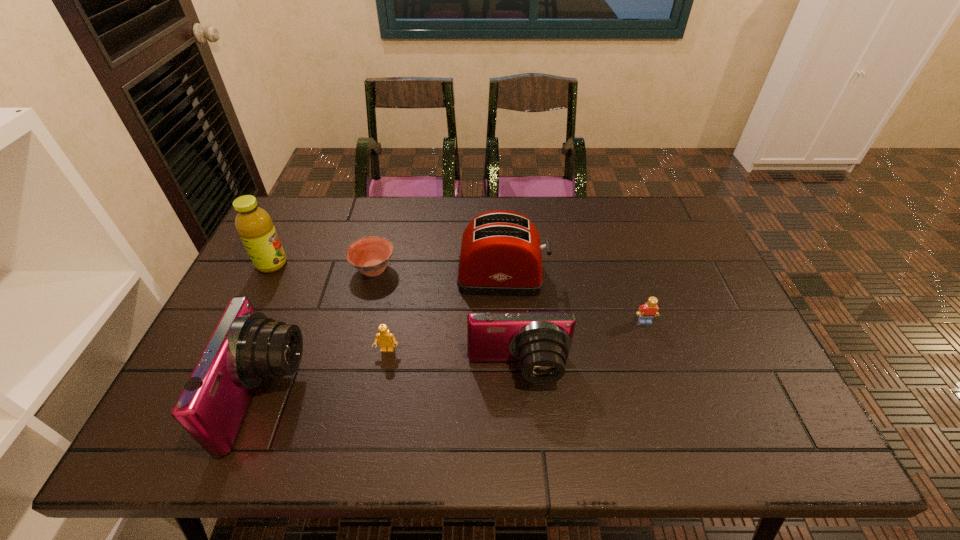
The image size is (960, 540). What are the coordinates of `the nearer Lego` in the screenshot? It's located at (385, 339).

You are a GUI agent. You are given a task and a screenshot of the screen. Output one action in this format:
    pyautogui.click(x=<x>, y=<y>)
    Task: Click on the vacant point located 0.210m on the front-facing side of the second object from left to right
    The width and height of the screenshot is (960, 540).
    Given the screenshot: What is the action you would take?
    pyautogui.click(x=389, y=396)

Locate an element on the screen. This screenshot has height=540, width=960. vacant area located on the back of the shortest object is located at coordinates (387, 214).

What are the coordinates of `vacant space situated on the front label of the fruit juice` in the screenshot? It's located at (399, 264).

Where is `free space located 0.210m on the front-facing side of the rightmost object`? free space located 0.210m on the front-facing side of the rightmost object is located at coordinates (670, 396).

Where is `vacant space located on the front of the toaster`? vacant space located on the front of the toaster is located at coordinates (506, 359).

Locate an element on the screen. This screenshot has width=960, height=540. vacant region located on the face of the nearer Lego is located at coordinates (379, 395).

This screenshot has width=960, height=540. Find the location of `camera positioned at the left edge`. camera positioned at the left edge is located at coordinates (246, 348).

Where is `fruit juice at the left edge`? This screenshot has height=540, width=960. fruit juice at the left edge is located at coordinates (254, 224).

At what (x,y) coordinates should I click in order to perform the action: click on object that is at the near left corner. Please return your answer as a coordinate pair (x, y). Image resolution: width=960 pixels, height=540 pixels. Looking at the image, I should click on (246, 348).